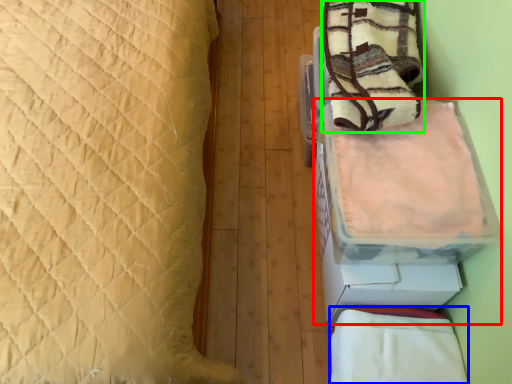
Question: Considering the real-world distances, which object is farthest from cardboard box (highlighted by a red box)? blanket (highlighted by a blue box) or blanket (highlighted by a green box)?

Choices:
 (A) blanket
 (B) blanket

Answer: (B)